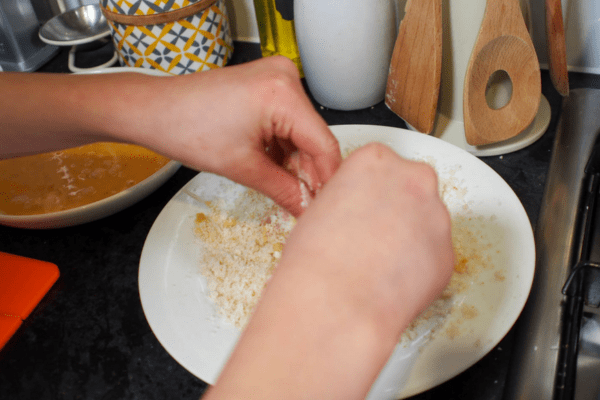
Where is `red cutting board`? This screenshot has height=400, width=600. red cutting board is located at coordinates (24, 289).